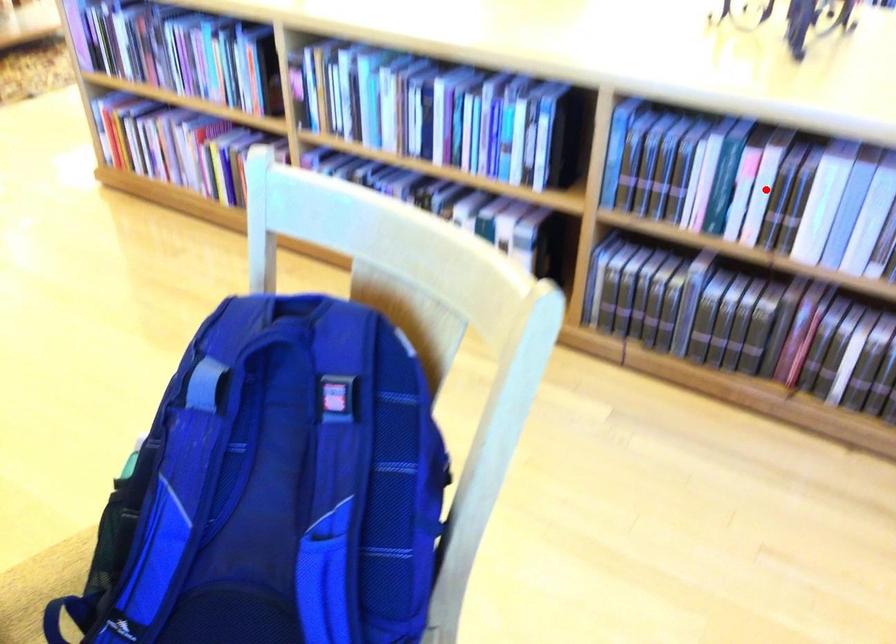
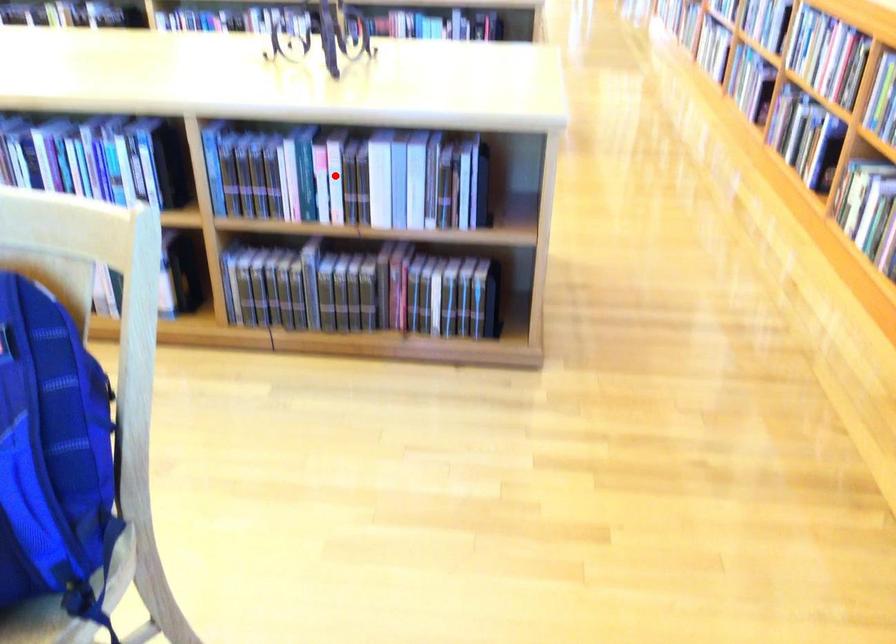
I am providing you with two images of the same scene from different viewpoints. A red point is marked on the first image and another point is marked on the second image. Are the points marked in image1 and image2 representing the same 3D position?

Yes